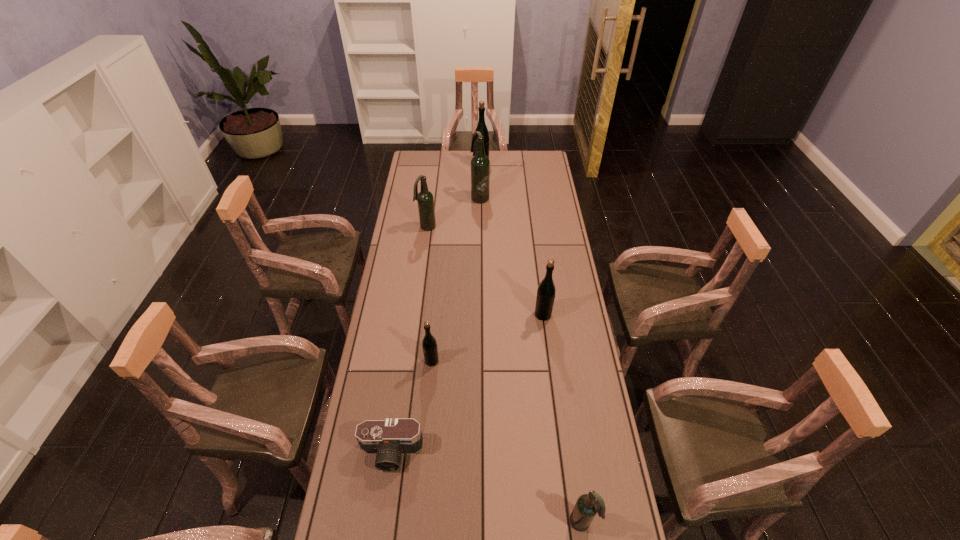
The height and width of the screenshot is (540, 960). Identify the location of vacant space located on the front-facing side of the camera. (386, 490).

Where is `object positioned at the far edge`? This screenshot has width=960, height=540. object positioned at the far edge is located at coordinates (481, 127).

I want to click on beer bottle that is at the left edge, so click(425, 200).

At what (x,y) coordinates should I click in order to perform the action: click on camera present at the left edge. Please return your answer as a coordinate pair (x, y). Image resolution: width=960 pixels, height=540 pixels. Looking at the image, I should click on (388, 439).

Identify the location of blank space at the far edge. The width and height of the screenshot is (960, 540). (447, 163).

This screenshot has height=540, width=960. I want to click on free space at the left edge, so click(x=418, y=231).

This screenshot has width=960, height=540. In order to click on vacant area at the right edge in this screenshot , I will do `click(561, 299)`.

This screenshot has width=960, height=540. Find the location of `free spot at the far left corner of the desktop`. free spot at the far left corner of the desktop is located at coordinates click(x=433, y=157).

Find the location of a particular element. The image size is (960, 540). free space at the far right corner of the desktop is located at coordinates (539, 157).

Identify the location of empty location between the second farthest beer bottle and the nearest dark beer bottle. (531, 360).